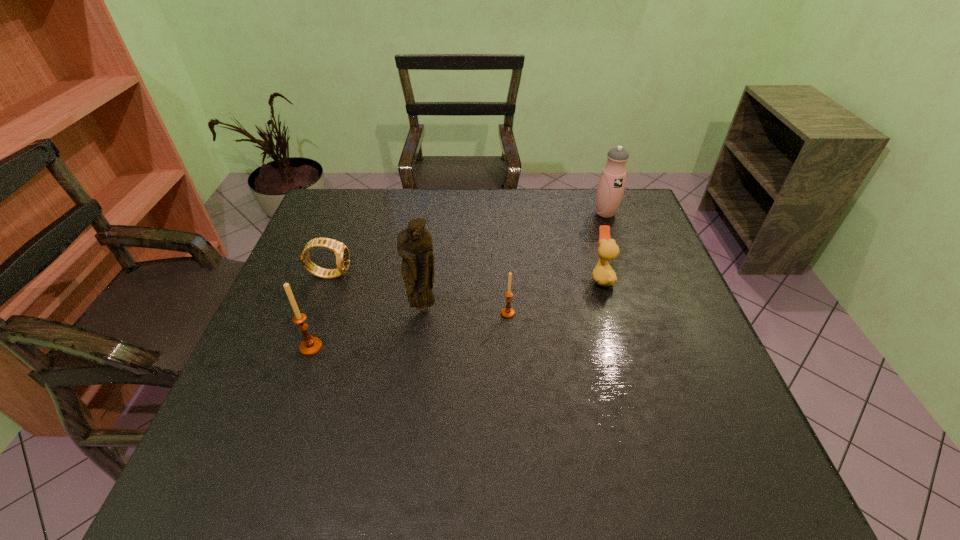
Locate an element on the screen. the left candle_holder is located at coordinates (310, 346).

Locate an element on the screen. Image resolution: width=960 pixels, height=540 pixels. the nearest object is located at coordinates (310, 346).

Locate an element on the screen. the right candle_holder is located at coordinates (507, 312).

Where is `the fourth object from left to right`? the fourth object from left to right is located at coordinates (507, 312).

The image size is (960, 540). What are the coordinates of `the farthest object` in the screenshot? It's located at (611, 185).

Find the location of `the rightmost object`. the rightmost object is located at coordinates (611, 185).

Where is `figurine`? figurine is located at coordinates (414, 244).

At what (x,y) coordinates should I click in order to perform the action: click on the third object from left to right. Please return your answer as a coordinate pair (x, y). The image size is (960, 540). Looking at the image, I should click on (414, 244).

Locate an element on the screen. Image resolution: width=960 pixels, height=540 pixels. the fifth object from left to right is located at coordinates (603, 274).

The image size is (960, 540). Find the location of `watch`. watch is located at coordinates (341, 251).